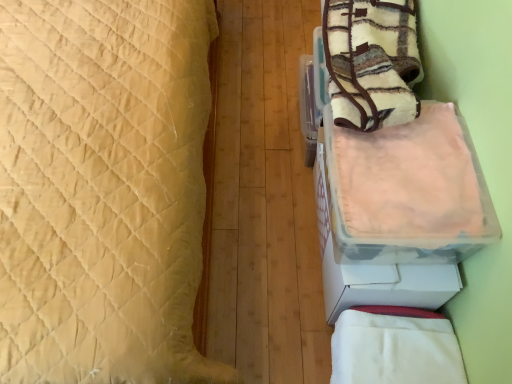
Question: From their relative heights in the image, would you say white soft blanket at lower right, acting as the 1th blanket starting from the bottom, is taller or shorter than beige quilted bed at left?

Choices:
 (A) short
 (B) tall

Answer: (A)

Question: Is white soft blanket at lower right, acting as the second blanket starting from the top, situated inside beige quilted bed at left or outside?

Choices:
 (A) inside
 (B) outside

Answer: (B)

Question: Estimate the real-world distances between objects in this image. Which object is farther from the white soft blanket at lower right, acting as the second blanket starting from the top?

Choices:
 (A) beige quilted bed at left
 (B) fluffy fleece blanket at upper right, the 2th blanket ordered from the bottom
 (C) translucent plastic container at right

Answer: (A)

Question: Estimate the real-world distances between objects in this image. Which object is closer to the beige quilted bed at left?

Choices:
 (A) translucent plastic container at right
 (B) fluffy fleece blanket at upper right, the 1th blanket positioned from the top
 (C) white soft blanket at lower right, acting as the second blanket starting from the top

Answer: (A)